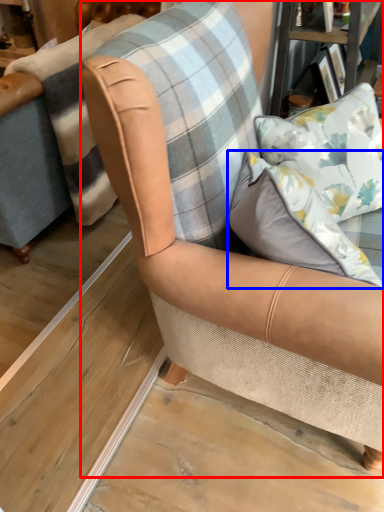
Question: Among these objects, which one is farthest to the camera, chair (highlighted by a red box) or pillow (highlighted by a blue box)?

Choices:
 (A) chair
 (B) pillow

Answer: (A)